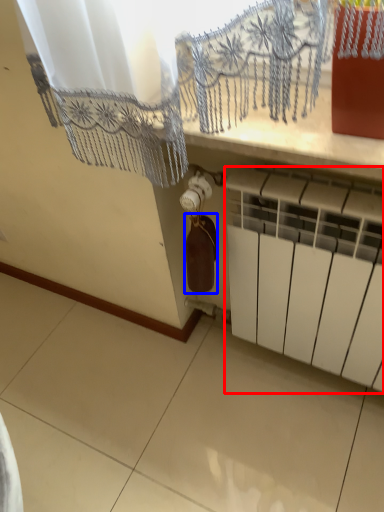
Question: Which of the following is the closest to the observer, radiator (highlighted by a red box) or wine bottle (highlighted by a blue box)?

Choices:
 (A) radiator
 (B) wine bottle

Answer: (A)